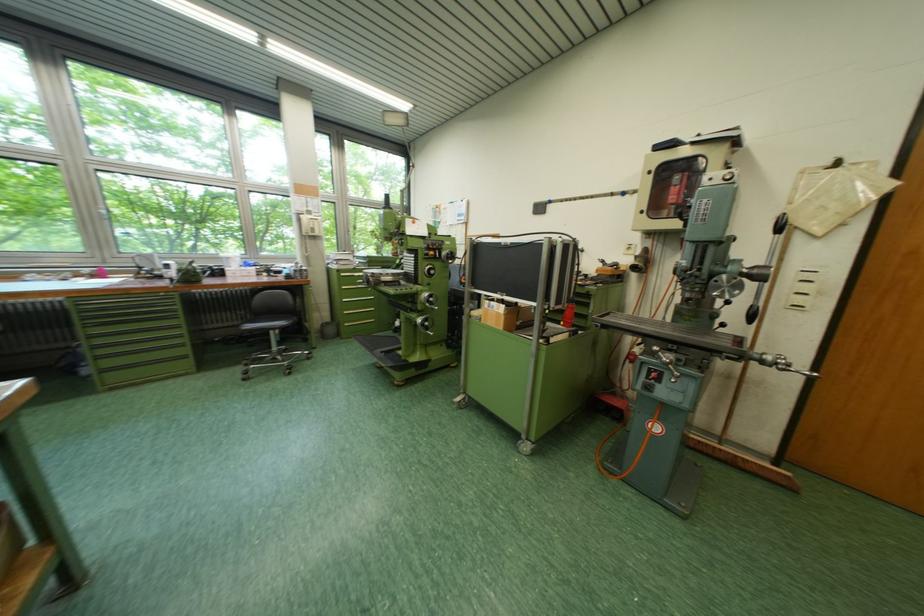
The height and width of the screenshot is (616, 924). What do you see at coordinates (268, 323) in the screenshot? I see `a black chair sitting surface` at bounding box center [268, 323].